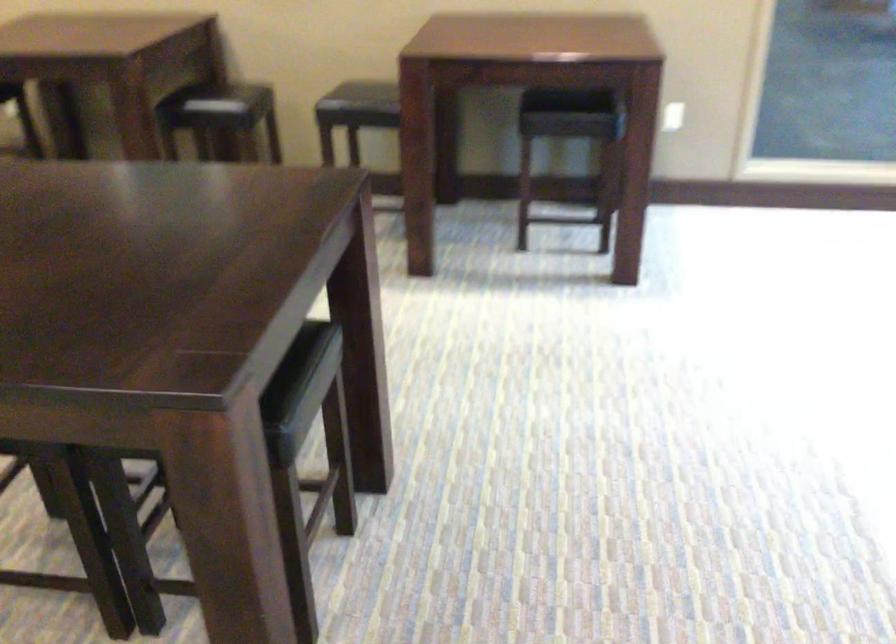
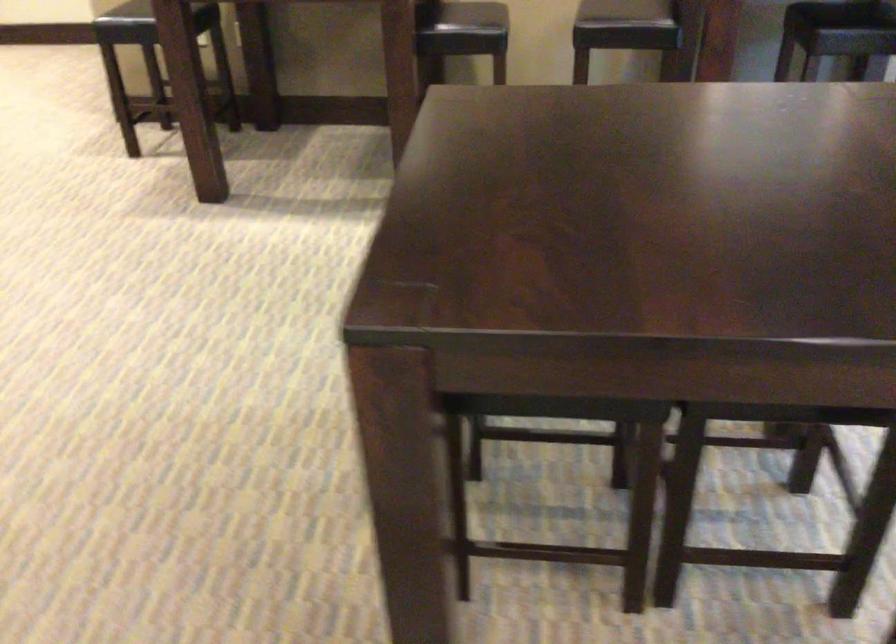
Question: The images are taken continuously from a first-person perspective. In which direction is your viewpoint rotating?

Choices:
 (A) Left
 (B) Right
 (C) Up
 (D) Down

Answer: (D)